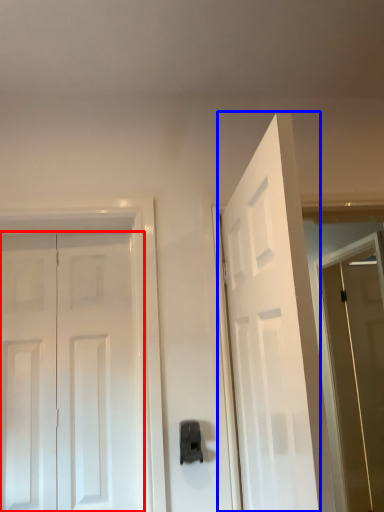
Question: Among these objects, which one is farthest to the camera, door (highlighted by a red box) or door (highlighted by a blue box)?

Choices:
 (A) door
 (B) door

Answer: (A)